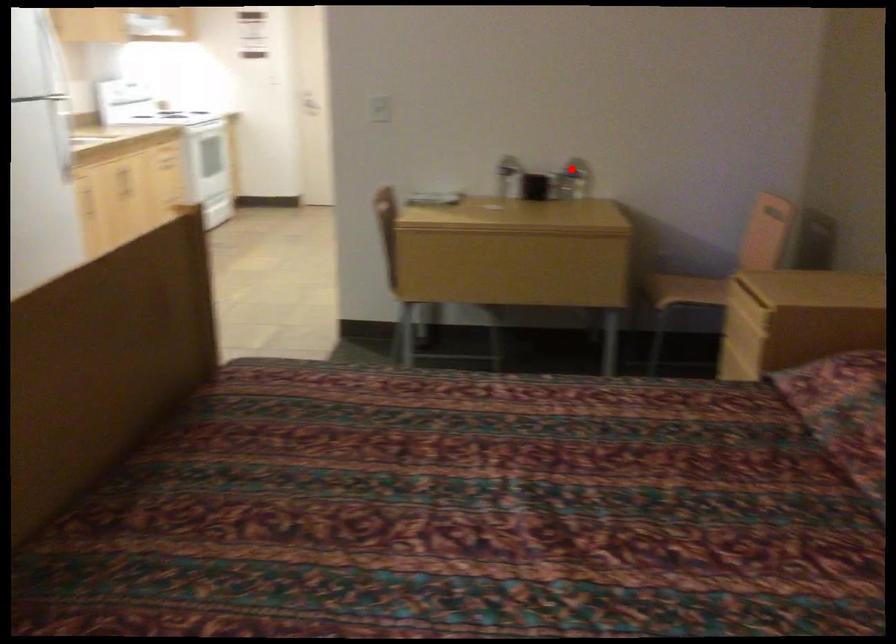
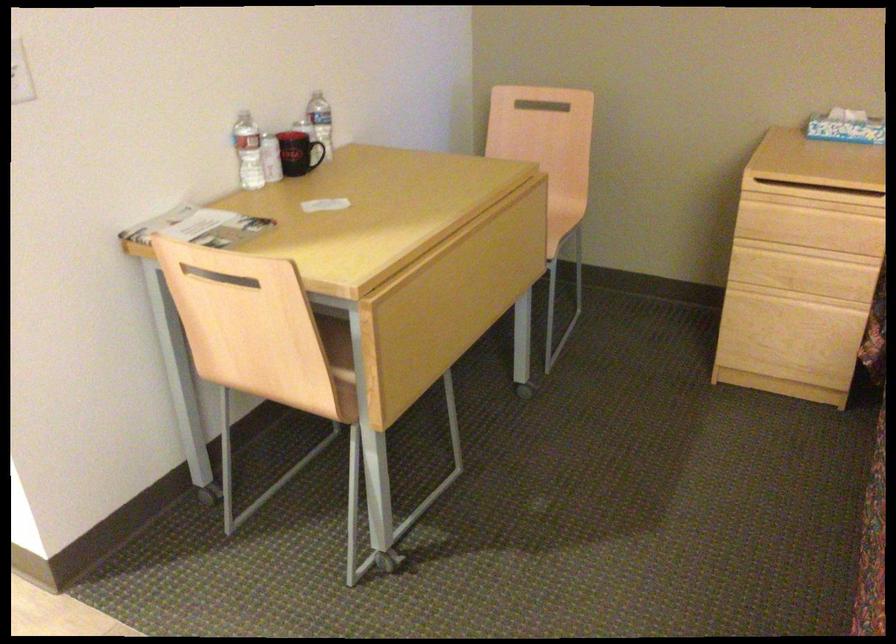
Locate, in the second image, the point that corresponds to the highlighted location in the first image.

(321, 122)